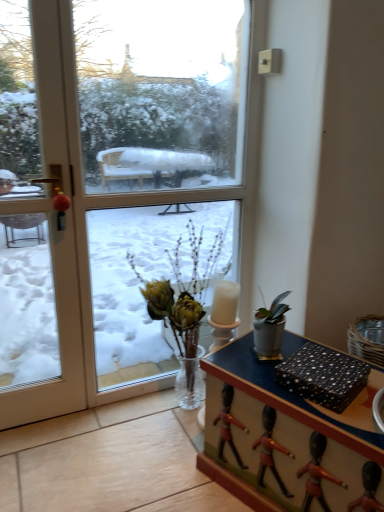
Where is `empty space that is ontop of wooden desk at center`? This screenshot has width=384, height=512. empty space that is ontop of wooden desk at center is located at coordinates (312, 397).